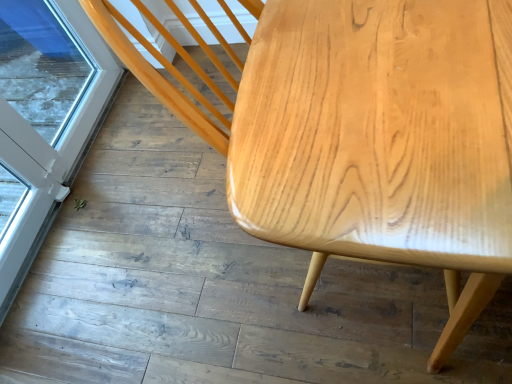
What is the approximate height of light wood table at upper right?

light wood table at upper right is 5.35 centimeters in height.

This screenshot has width=512, height=384. I want to click on light wood table at upper right, so click(381, 140).

The height and width of the screenshot is (384, 512). What do you see at coordinates (381, 140) in the screenshot?
I see `light wood table at upper right` at bounding box center [381, 140].

This screenshot has width=512, height=384. What do you see at coordinates (47, 124) in the screenshot? I see `transparent glass screen door at lower left` at bounding box center [47, 124].

This screenshot has width=512, height=384. I want to click on transparent glass screen door at lower left, so click(x=47, y=124).

What is the approximate width of transparent glass screen door at lower left?

The width of transparent glass screen door at lower left is 3.33 inches.

Identify the location of light wood table at upper right. (381, 140).

Visually, is light wood table at upper right positioned to the left or to the right of transparent glass screen door at lower left?

Based on their positions, light wood table at upper right is located to the right of transparent glass screen door at lower left.

Does light wood table at upper right come behind transparent glass screen door at lower left?

No, it is in front of transparent glass screen door at lower left.

Which is nearer, [381,141] or [63,118]?

Point [381,141] is closer to the camera than point [63,118].

From the image's perspective, is light wood table at upper right beneath transparent glass screen door at lower left?

Indeed, from the image's perspective, light wood table at upper right is shown beneath transparent glass screen door at lower left.

From a real-world perspective, which is physically below, light wood table at upper right or transparent glass screen door at lower left?

In real-world perspective, light wood table at upper right is lower.

Is light wood table at upper right wider or thinner than transparent glass screen door at lower left?

Considering their sizes, light wood table at upper right looks broader than transparent glass screen door at lower left.

In the scene shown: From their relative heights in the image, would you say light wood table at upper right is taller or shorter than transparent glass screen door at lower left?

Clearly, light wood table at upper right is shorter compared to transparent glass screen door at lower left.

Looking at the image, does light wood table at upper right seem bigger or smaller compared to transparent glass screen door at lower left?

Clearly, light wood table at upper right is larger in size than transparent glass screen door at lower left.

Is light wood table at upper right located outside transparent glass screen door at lower left?

Yes, light wood table at upper right is outside of transparent glass screen door at lower left.

Is light wood table at upper right positioned far away from transparent glass screen door at lower left?

Indeed, light wood table at upper right is not near transparent glass screen door at lower left.

Is light wood table at upper right looking in the opposite direction of transparent glass screen door at lower left?

That's not correct — light wood table at upper right is not looking away from transparent glass screen door at lower left.

How many degrees apart are the facing directions of light wood table at upper right and transparent glass screen door at lower left?

light wood table at upper right and transparent glass screen door at lower left are facing 0.0741 degrees away from each other.

How much distance is there between light wood table at upper right and transparent glass screen door at lower left?

light wood table at upper right is 1.33 meters away from transparent glass screen door at lower left.

The height and width of the screenshot is (384, 512). I want to click on screen door behind the light wood table at upper right, so click(47, 124).

Does transparent glass screen door at lower left appear on the left side of light wood table at upper right?

Correct, you'll find transparent glass screen door at lower left to the left of light wood table at upper right.

Considering their positions, is transparent glass screen door at lower left located in front of or behind light wood table at upper right?

transparent glass screen door at lower left is behind light wood table at upper right.

Considering the positions of point (65, 186) and point (426, 58), is point (65, 186) closer or farther from the camera than point (426, 58)?

Point (65, 186) is farther from the camera than point (426, 58).

From the image's perspective, which object appears higher, transparent glass screen door at lower left or light wood table at upper right?

transparent glass screen door at lower left, from the image's perspective.

From a real-world perspective, who is located higher, transparent glass screen door at lower left or light wood table at upper right?

From a 3D spatial view, transparent glass screen door at lower left is above.

Can you confirm if transparent glass screen door at lower left is thinner than light wood table at upper right?

Indeed, transparent glass screen door at lower left has a lesser width compared to light wood table at upper right.

Considering the sizes of objects transparent glass screen door at lower left and light wood table at upper right in the image provided, who is taller, transparent glass screen door at lower left or light wood table at upper right?

With more height is transparent glass screen door at lower left.

Between transparent glass screen door at lower left and light wood table at upper right, which one has smaller size?

transparent glass screen door at lower left.

Do you think transparent glass screen door at lower left is within light wood table at upper right, or outside of it?

transparent glass screen door at lower left is not enclosed by light wood table at upper right.

Does transparent glass screen door at lower left touch light wood table at upper right?

No, transparent glass screen door at lower left is not in contact with light wood table at upper right.

Does transparent glass screen door at lower left turn towards light wood table at upper right?

Yes, transparent glass screen door at lower left faces towards light wood table at upper right.

How different are the orientations of transparent glass screen door at lower left and light wood table at upper right in degrees?

They differ by 0.0741 degrees in their facing directions.

Measure the distance from transparent glass screen door at lower left to light wood table at upper right.

transparent glass screen door at lower left is 4.36 feet away from light wood table at upper right.

Where is `table to the right of transparent glass screen door at lower left`? This screenshot has height=384, width=512. table to the right of transparent glass screen door at lower left is located at coordinates (381, 140).

Locate an element on the screen. This screenshot has width=512, height=384. table on the right side of transparent glass screen door at lower left is located at coordinates (381, 140).

You are a GUI agent. You are given a task and a screenshot of the screen. Output one action in this format:
    pyautogui.click(x=<x>, y=<y>)
    Task: Click on the screen door positioned vertically above the light wood table at upper right (from a real-world perspective)
    This screenshot has width=512, height=384.
    Given the screenshot: What is the action you would take?
    pyautogui.click(x=47, y=124)